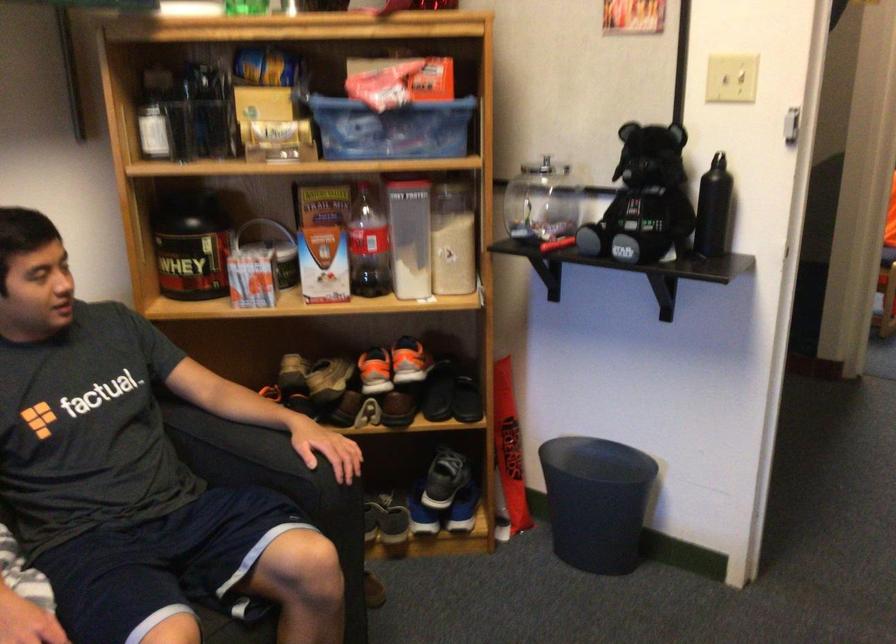
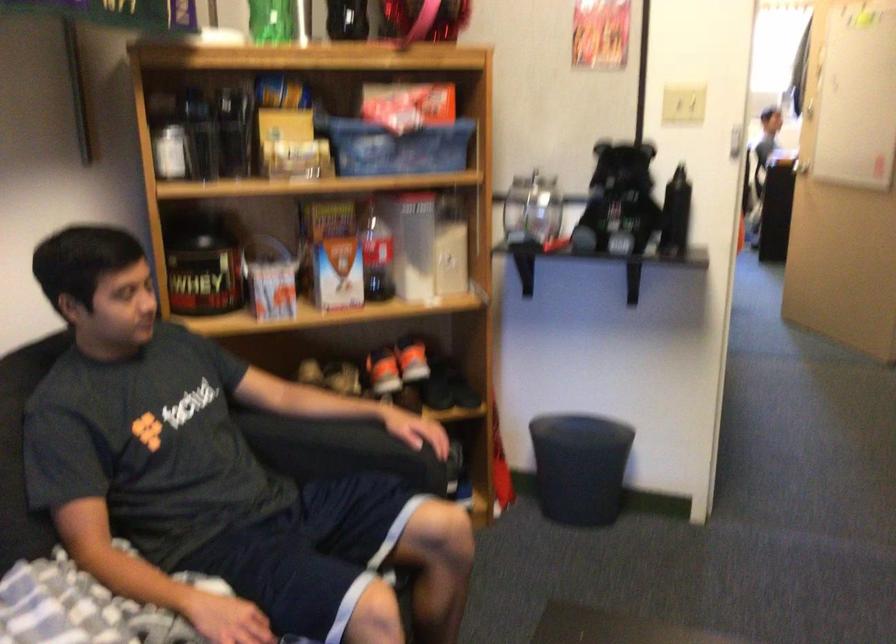
In the second image, find the point that corresponds to [702,220] in the first image.

(675, 214)